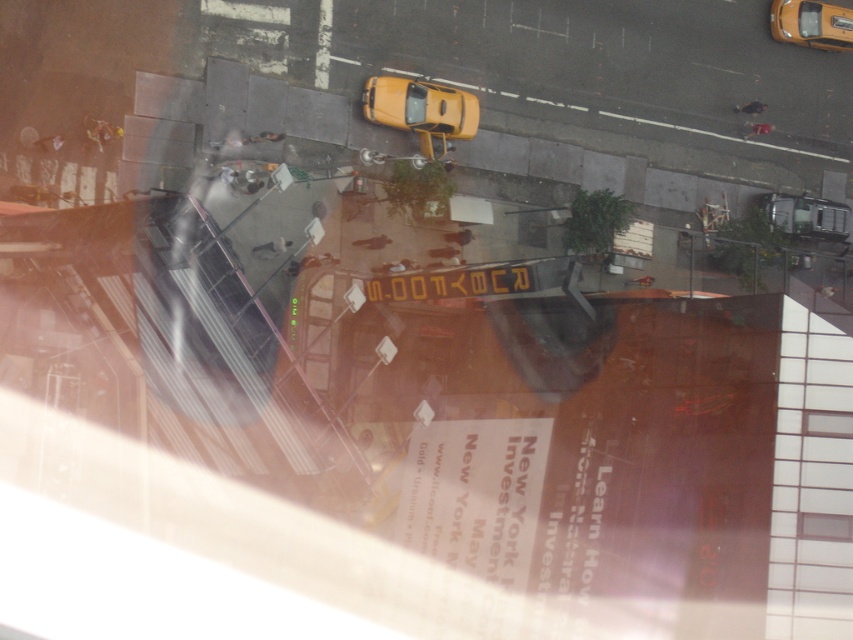
You are standing at the window where the photo was taken and want to direct someone to the yellow matte taxi at center. Based on its coordinates, which direction should they walk from the window to find it?

The yellow matte taxi at center is located at coordinates point (421,109), so they should walk towards the lower right direction from the window to find it.

You are standing on the sidewalk and looking down the street. You see the yellow matte taxi at upper right and the metallic silver car at lower right. Which vehicle is closer to you?

The yellow matte taxi at upper right is closer to you because it is in front of the metallic silver car at lower right.